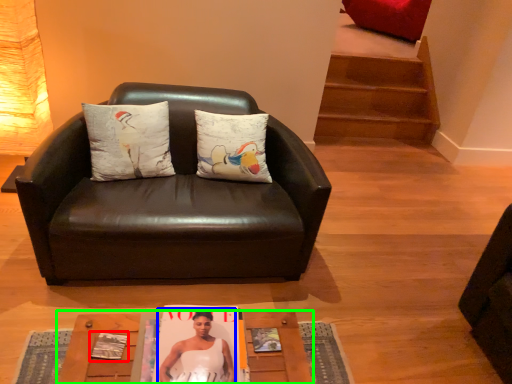
Question: Based on their relative distances, which object is nearer to magazine (highlighted by a red box)? Choose from person (highlighted by a blue box) and table (highlighted by a green box).

Choices:
 (A) person
 (B) table

Answer: (A)